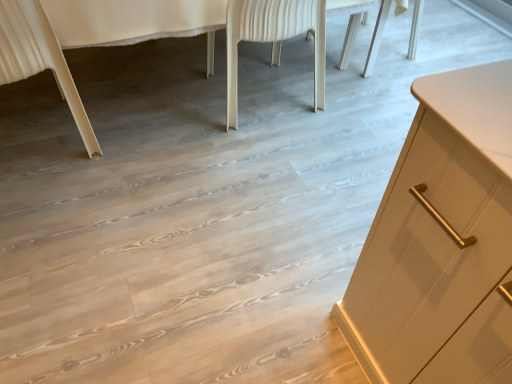
At what (x,y) coordinates should I click in order to perform the action: click on vacant space that's between white glossy cabinet at right and light beige wood chair leg at lower left, which is counted as the 2th chair, starting from the right. Please return your answer as a coordinate pair (x, y). Looking at the image, I should click on (166, 137).